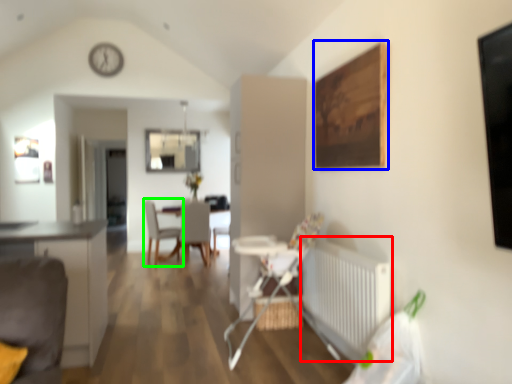
Question: Which object is the closest to the radiator (highlighted by a red box)? Choose among these: picture frame (highlighted by a blue box) or chair (highlighted by a green box).

Choices:
 (A) picture frame
 (B) chair

Answer: (A)